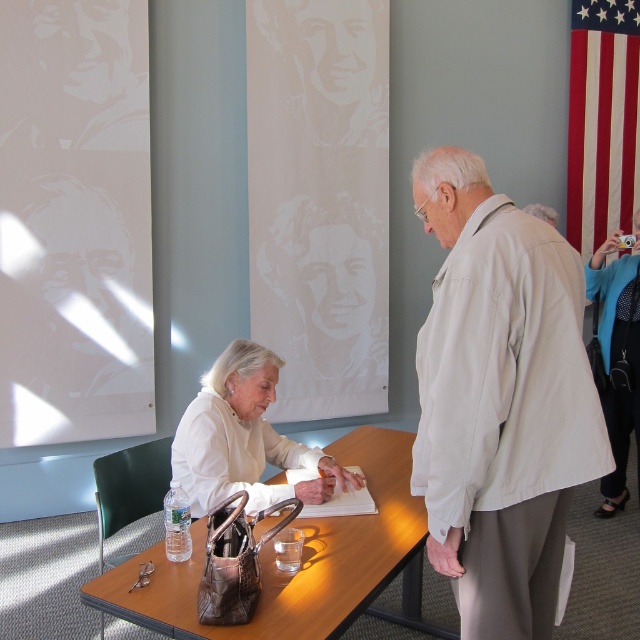
Where is `red fabric flag at upper right`? Image resolution: width=640 pixels, height=640 pixels. red fabric flag at upper right is located at coordinates (602, 120).

Based on the photo, which is more to the left, red fabric flag at upper right or white matte shirt at center?

Positioned to the left is white matte shirt at center.

Image resolution: width=640 pixels, height=640 pixels. Identify the location of red fabric flag at upper right. (602, 120).

Is white matte shirt at center thinner than blue textured sweater at upper right?

No, white matte shirt at center is not thinner than blue textured sweater at upper right.

Between point (252, 342) and point (608, 404), which one is positioned in front?

Point (252, 342) is in front.

Find the location of `white matte shirt at center`. white matte shirt at center is located at coordinates (244, 438).

Is point (520, 252) closer to viewer compared to point (461, 371)?

No, (520, 252) is behind (461, 371).

Can you confirm if beige cotton shirt at right is thinner than light beige shirt at center?

Correct, beige cotton shirt at right's width is less than light beige shirt at center's.

Is point (529, 333) in front of point (518, 634)?

Yes, point (529, 333) is in front of point (518, 634).

The image size is (640, 640). In order to click on beige cotton shirt at right in this screenshot , I will do `click(500, 401)`.